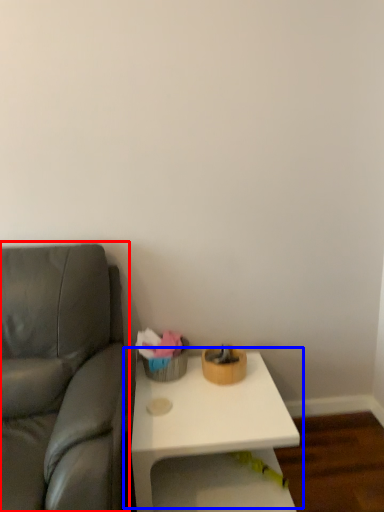
Question: Which object appears farthest to the camera in this image, studio couch (highlighted by a red box) or table (highlighted by a blue box)?

Choices:
 (A) studio couch
 (B) table

Answer: (B)